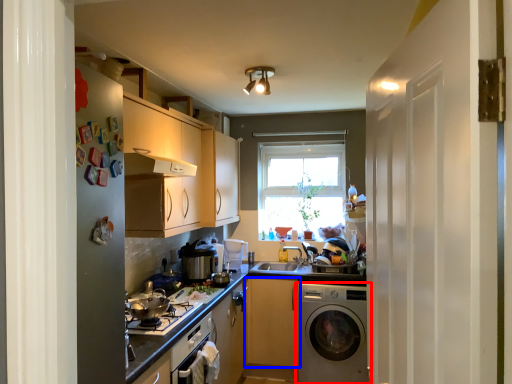
Question: Among these objects, which one is farthest to the camera, washing machine (highlighted by a red box) or cabinetry (highlighted by a blue box)?

Choices:
 (A) washing machine
 (B) cabinetry

Answer: (B)